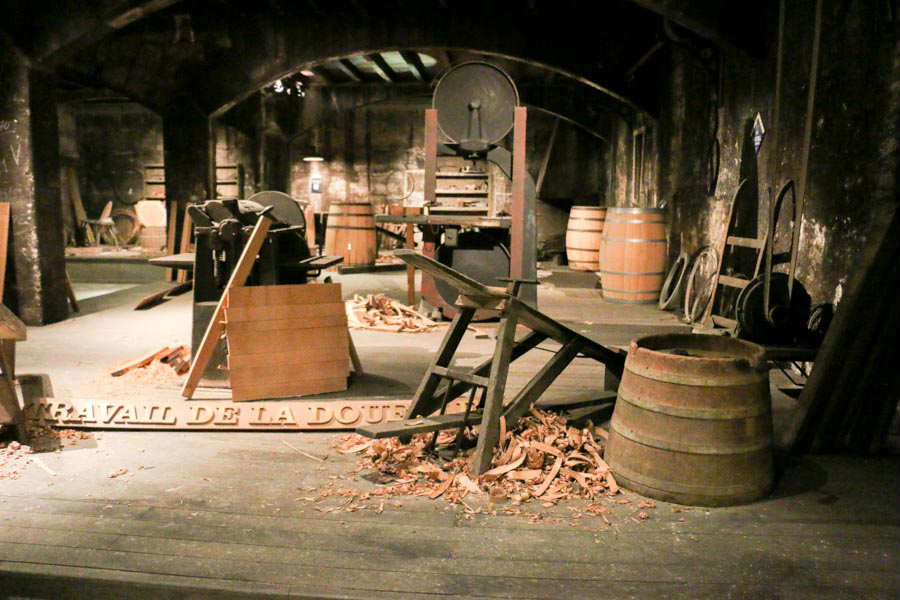
This screenshot has height=600, width=900. I want to click on walls, so [842, 133], [765, 89], [388, 135], [135, 142].